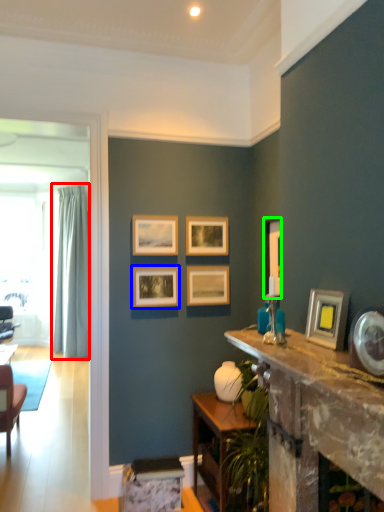
Question: Which object is the closest to the curtain (highlighted by a red box)? Choose among these: picture frame (highlighted by a blue box) or picture frame (highlighted by a green box).

Choices:
 (A) picture frame
 (B) picture frame

Answer: (A)